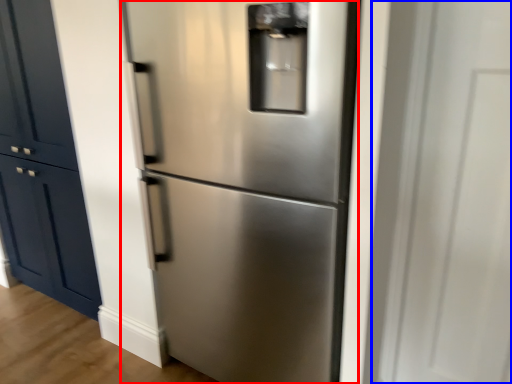
Question: Which object is closer to the camera taking this photo, refrigerator (highlighted by a red box) or glass door (highlighted by a blue box)?

Choices:
 (A) refrigerator
 (B) glass door

Answer: (B)